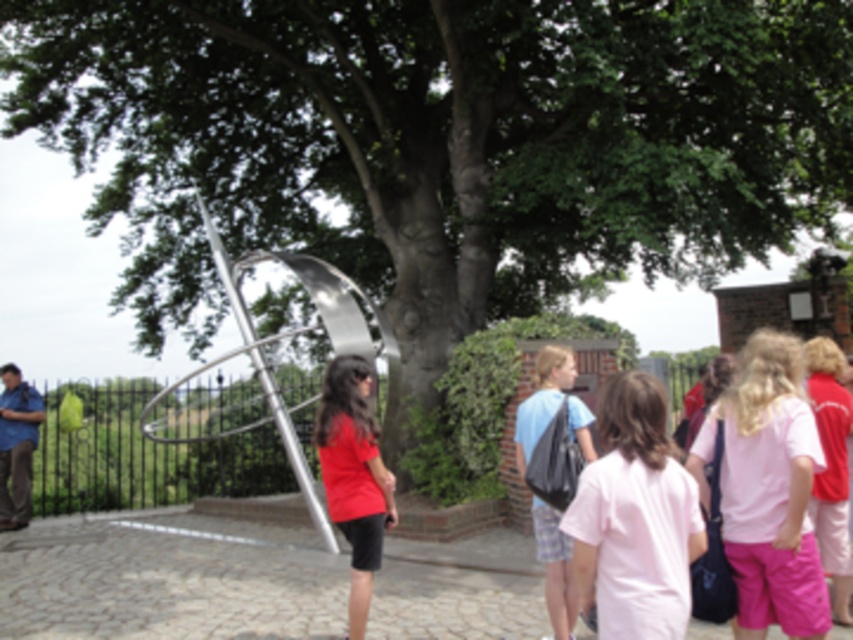
In the scene shown: You are standing at the point with coordinates point (207, 413) and want to walk towards the point (582, 609). Which direction should you move?

Since point (582, 609) is in front of point (207, 413), you should move forward towards it.

From the picture: You are standing in the outdoor area and want to take a photo of the shiny metallic sculpture at center and the matte red shirt at center. Which object should you position to the right side of your camera frame to include both in the shot?

You should position the matte red shirt at center to the right side of your camera frame because the shiny metallic sculpture at center is located to the left of the matte red shirt at center.

You are an artist planning to paint this scene. You want to ensure the shiny metallic sculpture at center is proportionally accurate compared to the matte red shirt at center. Which object should you paint as taller in your artwork?

The matte red shirt at center should be painted taller than the shiny metallic sculpture at center since the shiny metallic sculpture at center has a lesser height compared to matte red shirt at center.